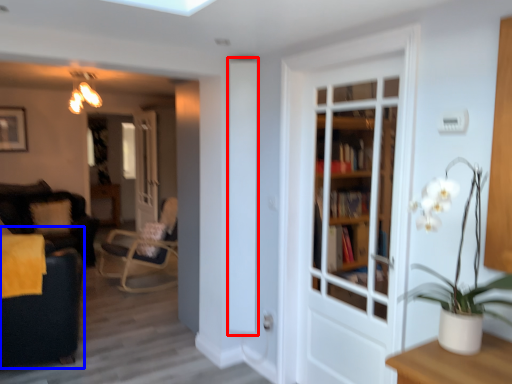
Question: Among these objects, which one is nearest to the camera, screen door (highlighted by a red box) or swivel chair (highlighted by a blue box)?

Choices:
 (A) screen door
 (B) swivel chair

Answer: (B)